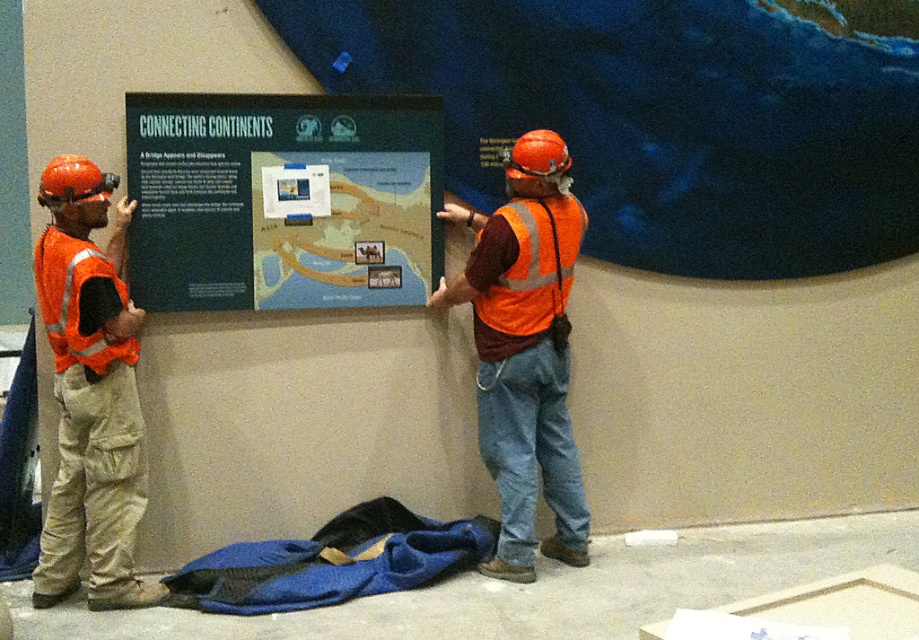
Question: Considering the real-world distances, which object is closest to the green matte signboard at center?

Choices:
 (A) matte orange safety vest at left
 (B) reflective orange vest at center
 (C) orange reflective safety vest at center

Answer: (A)

Question: Does reflective orange vest at center come behind matte orange safety vest at left?

Choices:
 (A) no
 (B) yes

Answer: (B)

Question: Is green matte signboard at center above reflective orange vest at center?

Choices:
 (A) no
 (B) yes

Answer: (B)

Question: Among these points, which one is farthest from the camera?

Choices:
 (A) (532, 140)
 (B) (520, 272)

Answer: (B)

Question: Is green matte signboard at center positioned behind orange reflective safety vest at center?

Choices:
 (A) no
 (B) yes

Answer: (A)

Question: Which of the following is the farthest from the observer?

Choices:
 (A) orange reflective safety vest at center
 (B) matte orange safety vest at left

Answer: (A)